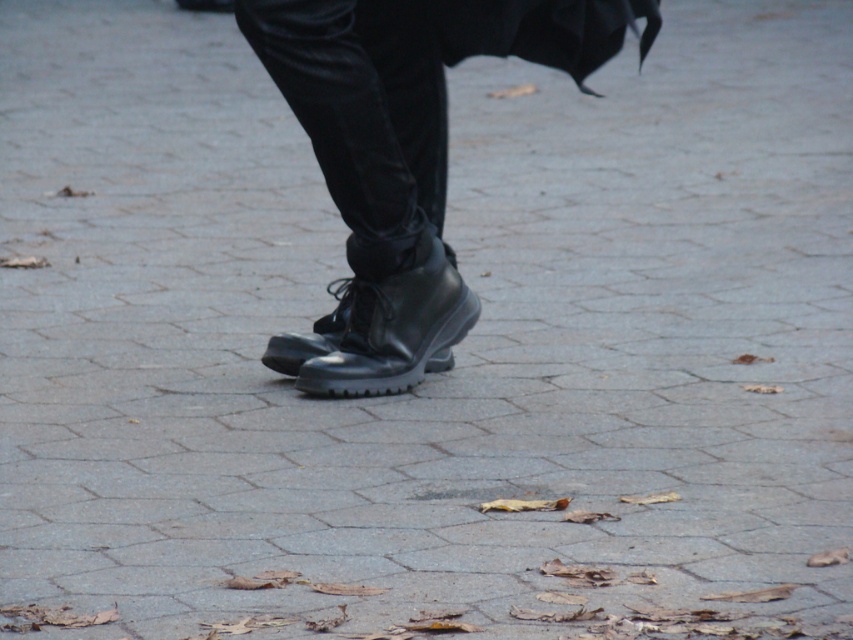
You are trying to decide between two pairs of boots displayed in a store window. The shiny black boots at center and the black leather boot at center. Which pair reaches higher up your leg?

The shiny black boots at center is much taller than the black leather boot at center, so it reaches higher up your leg.

You are a fashion designer observing the image and want to create a pair of boots that match the style of the shiny black boots at center and the black leather boot at center. Which boot should you choose as the base for your design if you want to create a larger version?

The shiny black boots at center has a larger size compared to black leather boot at center, so you should choose the shiny black boots at center as the base for creating a larger version since they are already bigger.